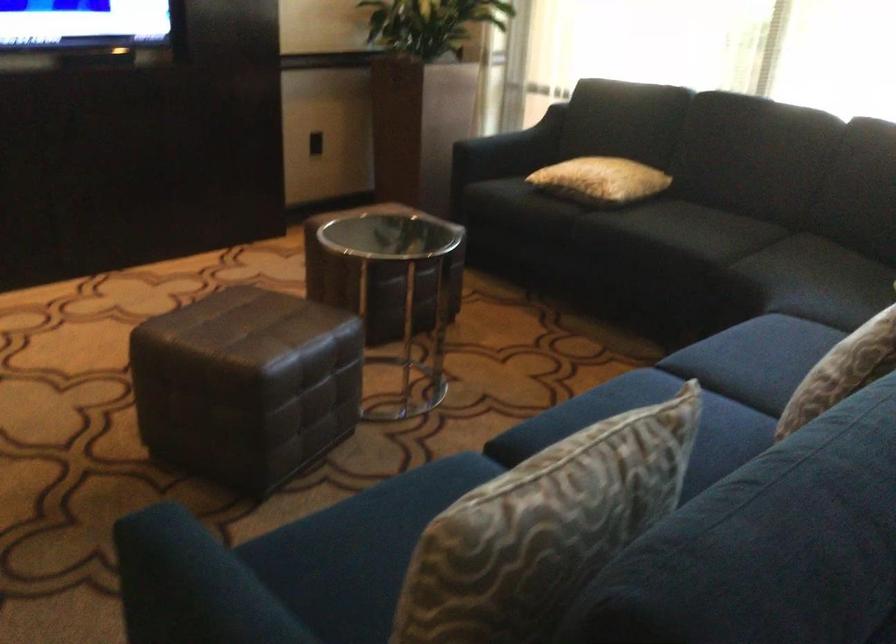
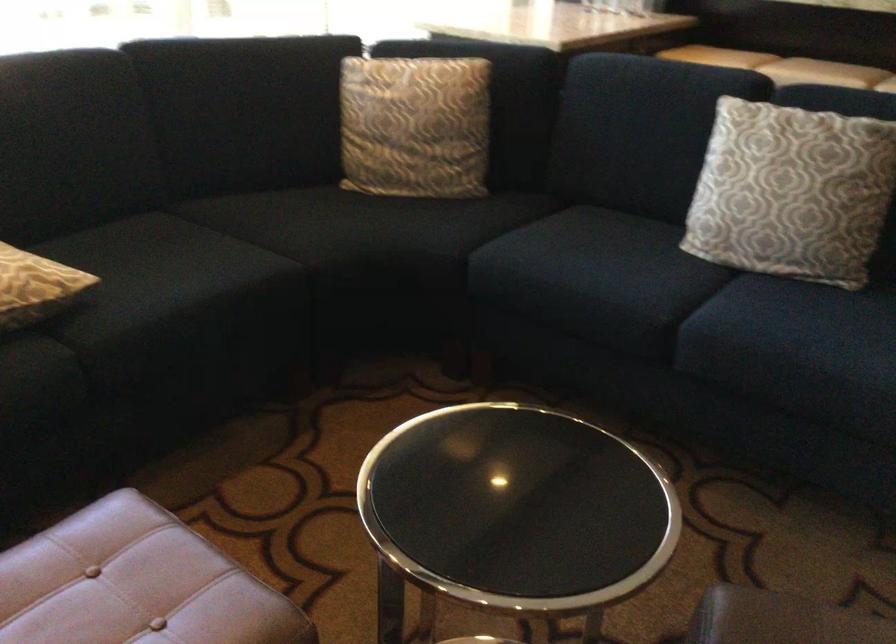
In the second image, find the point that corresponds to the point at 798,270 in the first image.

(348, 227)